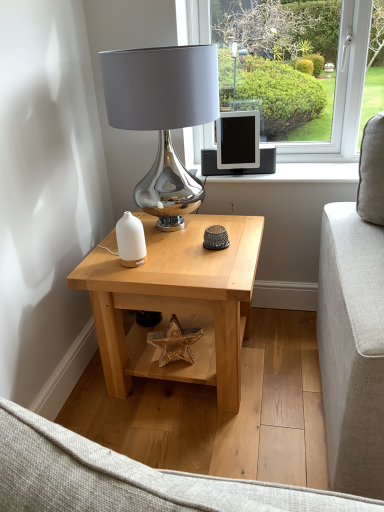
Where is `free region on the left part of white glossy candle holder at center`? free region on the left part of white glossy candle holder at center is located at coordinates (100, 266).